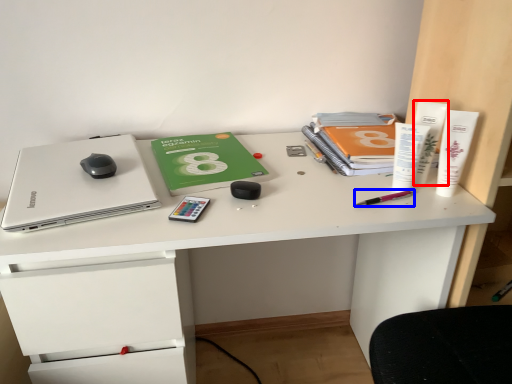
Question: Among these objects, which one is nearest to the camera, stationery (highlighted by a red box) or stationery (highlighted by a blue box)?

Choices:
 (A) stationery
 (B) stationery

Answer: (B)